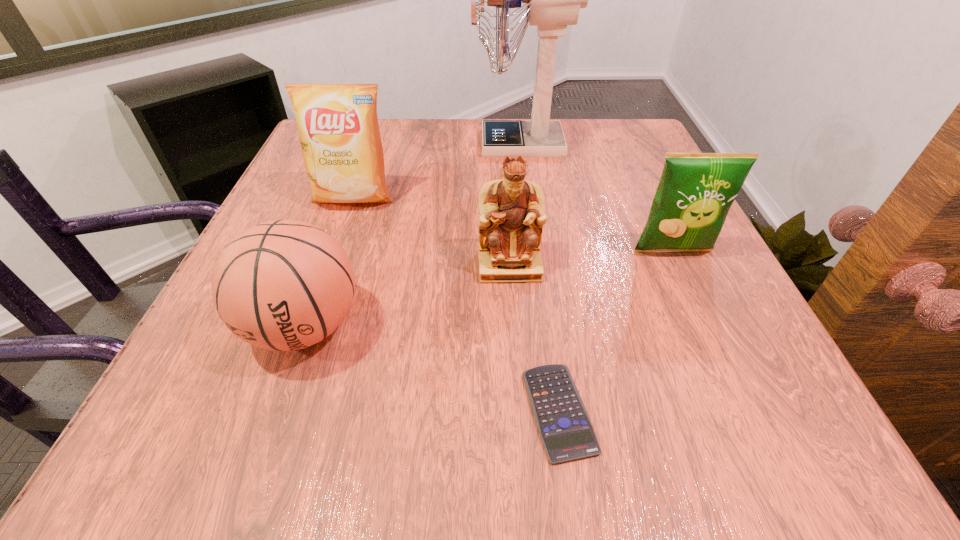
At what (x,y) coordinates should I click in order to perform the action: click on basketball situated at the left edge. Please return your answer as a coordinate pair (x, y). The height and width of the screenshot is (540, 960). Looking at the image, I should click on (282, 285).

Locate an element on the screen. object at the right edge is located at coordinates (696, 190).

Find the location of `vacant region at the far edge`. vacant region at the far edge is located at coordinates (421, 140).

What are the coordinates of `free space at the left edge of the desktop` in the screenshot? It's located at tap(266, 397).

Identify the location of free point at the right edge. Image resolution: width=960 pixels, height=540 pixels. (631, 275).

You are a GUI agent. You are given a task and a screenshot of the screen. Output one action in this format:
    pyautogui.click(x=<x>, y=<y>)
    Task: Click on the vacant area at the near left corner
    
    Given the screenshot: What is the action you would take?
    pyautogui.click(x=203, y=449)

In the image, there is a desktop. At what (x,y) coordinates should I click in order to perform the action: click on vacant space at the far right corner. Please return your answer as a coordinate pair (x, y). This screenshot has height=540, width=960. Looking at the image, I should click on (593, 120).

At what (x,y) coordinates should I click in order to perform the action: click on empty space between the figurine and the farther crisp (potato chip). Please return your answer as a coordinate pair (x, y). Looking at the image, I should click on (431, 232).

Locate an element on the screen. This screenshot has width=960, height=540. unoccupied position between the figurine and the rightmost object is located at coordinates (591, 258).

I want to click on free space that is in between the farthest object and the farther crisp (potato chip), so [x=437, y=171].